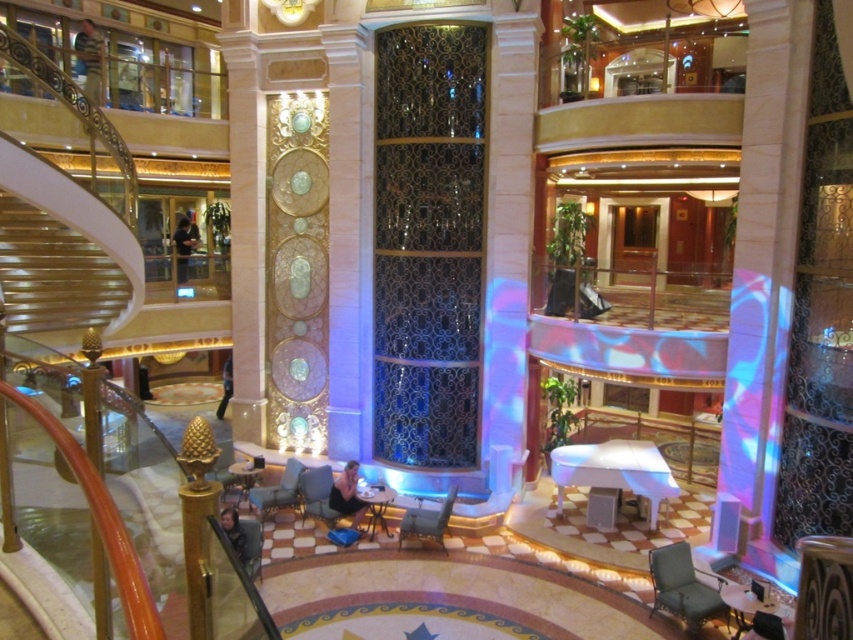
Is dark blue fabric at center bigger than black shirt at center?

Actually, dark blue fabric at center might be smaller than black shirt at center.

Between dark blue fabric at center and black shirt at center, which one has less height?

black shirt at center

Who is more distant from viewer, [334,490] or [190,244]?

Point [190,244]

The image size is (853, 640). I want to click on dark blue fabric at center, so click(347, 493).

Is light brown leather jacket at upper left to the left of dark blue jeans at lower left from the viewer's perspective?

Correct, you'll find light brown leather jacket at upper left to the left of dark blue jeans at lower left.

Between point (100, 49) and point (218, 410), which one is positioned in front?

Point (100, 49) is more forward.

Which is behind, point (84, 35) or point (228, 372)?

Positioned behind is point (228, 372).

Locate an element on the screen. light brown leather jacket at upper left is located at coordinates (90, 60).

Is light brown leather jacket at upper left taller than dark brown leather jacket at lower left?

Correct, light brown leather jacket at upper left is much taller as dark brown leather jacket at lower left.

Is light brown leather jacket at upper left positioned behind dark brown leather jacket at lower left?

Yes.

Does point (90, 33) come behind point (244, 561)?

Yes.

At what (x,y) coordinates should I click in order to perform the action: click on light brown leather jacket at upper left. Please return your answer as a coordinate pair (x, y). The height and width of the screenshot is (640, 853). Looking at the image, I should click on [90, 60].